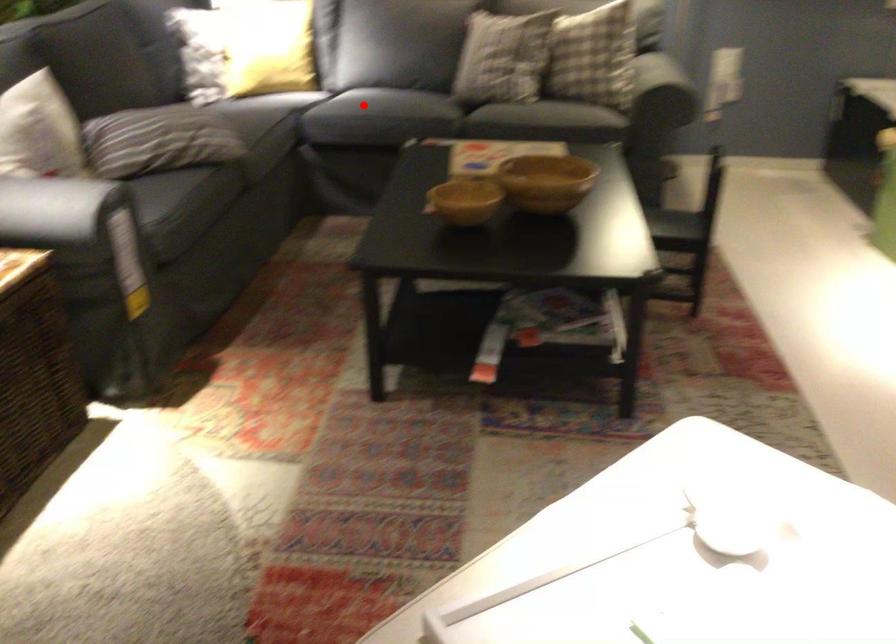
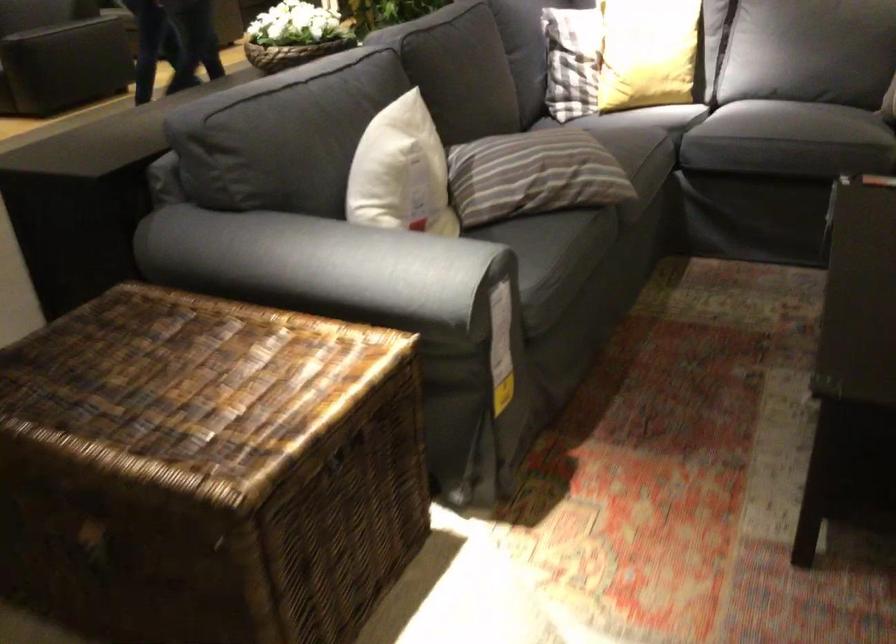
Question: I am providing you with two images of the same scene from different viewpoints. Image1 has a red point marked. In image2, the corresponding 3D location appears at what relative position? Reply with the corresponding letter.

Choices:
 (A) Closer
 (B) Farther

Answer: (A)